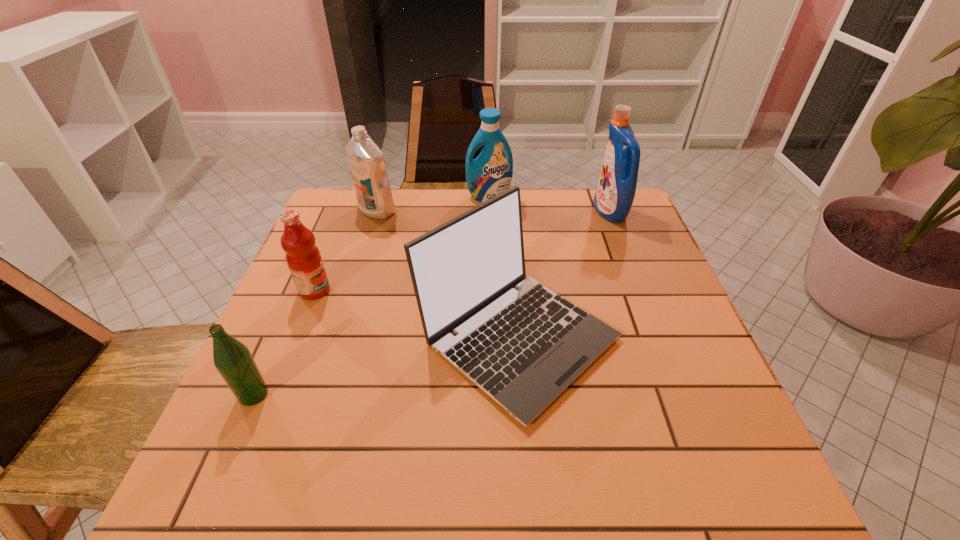
Find the location of a particular element. the rightmost object is located at coordinates (615, 192).

The image size is (960, 540). In order to click on the second detergent from left to right in this screenshot , I will do `click(490, 174)`.

This screenshot has height=540, width=960. I want to click on the leftmost detergent, so click(x=365, y=159).

Identify the location of laptop_computer. (523, 348).

You are a GUI agent. You are given a task and a screenshot of the screen. Output one action in this format:
    pyautogui.click(x=<x>, y=<y>)
    Task: Click on the fruit juice
    This screenshot has width=960, height=540.
    Given the screenshot: What is the action you would take?
    pyautogui.click(x=303, y=257)

The height and width of the screenshot is (540, 960). In order to click on bottle in this screenshot , I will do `click(233, 360)`.

Locate an element on the screen. This screenshot has width=960, height=540. free point located 0.210m on the label of the rightmost object is located at coordinates (523, 212).

Identify the location of free location located 0.120m on the label of the rightmost object. Image resolution: width=960 pixels, height=540 pixels. [554, 212].

Identify the location of blank area located on the label of the rightmost object. This screenshot has width=960, height=540. (506, 212).

Locate an element on the screen. The width and height of the screenshot is (960, 540). vacant space situated on the front-facing side of the second detergent from left to right is located at coordinates (492, 291).